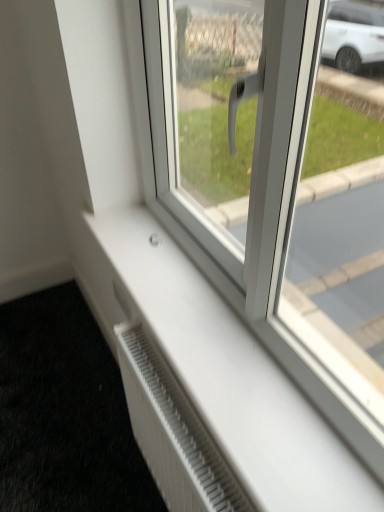
Question: Is white textured radiator at lower left thinner than white plastic radiator at lower center?

Choices:
 (A) no
 (B) yes

Answer: (A)

Question: Does white textured radiator at lower left come behind white plastic radiator at lower center?

Choices:
 (A) no
 (B) yes

Answer: (B)

Question: Is white textured radiator at lower left to the right of white plastic radiator at lower center from the viewer's perspective?

Choices:
 (A) yes
 (B) no

Answer: (B)

Question: From the image's perspective, is white textured radiator at lower left above white plastic radiator at lower center?

Choices:
 (A) no
 (B) yes

Answer: (A)

Question: Would you say white textured radiator at lower left is a long distance from white plastic radiator at lower center?

Choices:
 (A) yes
 (B) no

Answer: (B)

Question: Does white textured radiator at lower left turn towards white plastic radiator at lower center?

Choices:
 (A) yes
 (B) no

Answer: (B)

Question: Considering the relative sizes of white plastic radiator at lower center and white plastic window at center in the image provided, is white plastic radiator at lower center taller than white plastic window at center?

Choices:
 (A) no
 (B) yes

Answer: (B)

Question: From the image's perspective, is white plastic radiator at lower center on top of white plastic window at center?

Choices:
 (A) yes
 (B) no

Answer: (B)

Question: Is white plastic radiator at lower center at the left side of white plastic window at center?

Choices:
 (A) yes
 (B) no

Answer: (A)

Question: Are white plastic radiator at lower center and white plastic window at center located far from each other?

Choices:
 (A) yes
 (B) no

Answer: (B)

Question: From the image's perspective, would you say white plastic radiator at lower center is shown under white plastic window at center?

Choices:
 (A) no
 (B) yes

Answer: (B)

Question: Can you confirm if white plastic radiator at lower center is wider than white plastic window at center?

Choices:
 (A) no
 (B) yes

Answer: (A)

Question: Is white plastic radiator at lower center positioned behind white textured radiator at lower left?

Choices:
 (A) yes
 (B) no

Answer: (B)